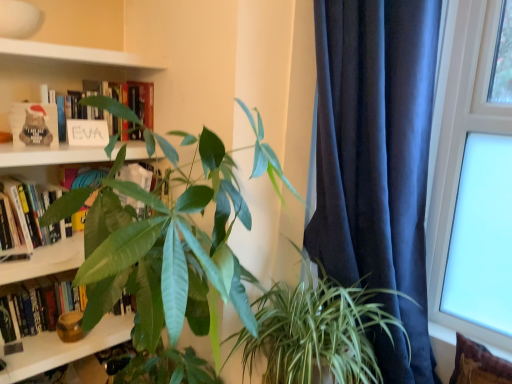
Question: Does transparent glass window at upper right lie behind green leafy plant at center, the 1th houseplant when ordered from right to left?

Choices:
 (A) yes
 (B) no

Answer: (A)

Question: Is transparent glass window at upper right taller than green leafy plant at center, the 1th houseplant when ordered from right to left?

Choices:
 (A) no
 (B) yes

Answer: (B)

Question: Can you confirm if transparent glass window at upper right is bigger than green leafy plant at center, which is the 2th houseplant from left to right?

Choices:
 (A) yes
 (B) no

Answer: (B)

Question: Is transparent glass window at upper right looking in the opposite direction of green leafy plant at center, which is the 2th houseplant from left to right?

Choices:
 (A) no
 (B) yes

Answer: (A)

Question: Does transparent glass window at upper right have a lesser width compared to green leafy plant at center, which is the 2th houseplant from left to right?

Choices:
 (A) yes
 (B) no

Answer: (A)

Question: Is transparent glass window at upper right at the left side of green leafy plant at center, which is the 2th houseplant from left to right?

Choices:
 (A) yes
 (B) no

Answer: (B)

Question: From a real-world perspective, does green leafy plant at center, which is the 2th houseplant from left to right, sit lower than transparent glass window at upper right?

Choices:
 (A) no
 (B) yes

Answer: (B)

Question: Can you confirm if green leafy plant at center, the 1th houseplant when ordered from right to left, is positioned to the right of transparent glass window at upper right?

Choices:
 (A) yes
 (B) no

Answer: (B)

Question: From the image's perspective, is green leafy plant at center, the 1th houseplant when ordered from right to left, over transparent glass window at upper right?

Choices:
 (A) yes
 (B) no

Answer: (B)

Question: Does green leafy plant at center, which is the 2th houseplant from left to right, have a greater width compared to transparent glass window at upper right?

Choices:
 (A) no
 (B) yes

Answer: (B)

Question: Is green leafy plant at center, the 1th houseplant when ordered from right to left, shorter than transparent glass window at upper right?

Choices:
 (A) yes
 (B) no

Answer: (A)

Question: Is transparent glass window at upper right located within green leafy plant at center, the 1th houseplant when ordered from right to left?

Choices:
 (A) no
 (B) yes

Answer: (A)

Question: Is white matte sign at upper left, the third book ordered from the bottom, aimed at brown textured pillow at lower right?

Choices:
 (A) yes
 (B) no

Answer: (B)